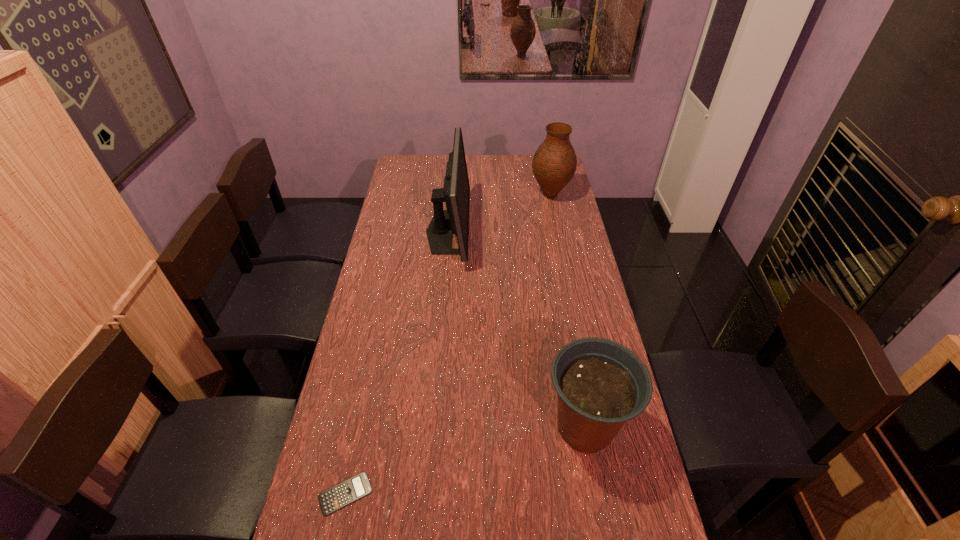
Image resolution: width=960 pixels, height=540 pixels. Identify the location of object at the left edge. (354, 488).

Image resolution: width=960 pixels, height=540 pixels. Identify the location of vase located at the right edge. (554, 163).

Identify the location of flowerpot that is at the right edge. Image resolution: width=960 pixels, height=540 pixels. (601, 384).

Where is `vacant space at the far edge`? The height and width of the screenshot is (540, 960). vacant space at the far edge is located at coordinates (474, 160).

Where is `blank space at the left edge of the desktop`? This screenshot has height=540, width=960. blank space at the left edge of the desktop is located at coordinates (387, 383).

Where is `blank space at the right edge of the desktop`? blank space at the right edge of the desktop is located at coordinates (578, 230).

The image size is (960, 540). In the image, there is a desktop. In order to click on vacant space at the far left corner in this screenshot , I will do `click(419, 154)`.

This screenshot has width=960, height=540. Find the location of `empty space between the calculator and the second shortest object`. empty space between the calculator and the second shortest object is located at coordinates (466, 460).

Find the location of `free spot between the calculator and the vase`. free spot between the calculator and the vase is located at coordinates (448, 345).

The image size is (960, 540). In order to click on free space between the computer monitor and the vase in this screenshot , I will do `click(499, 213)`.